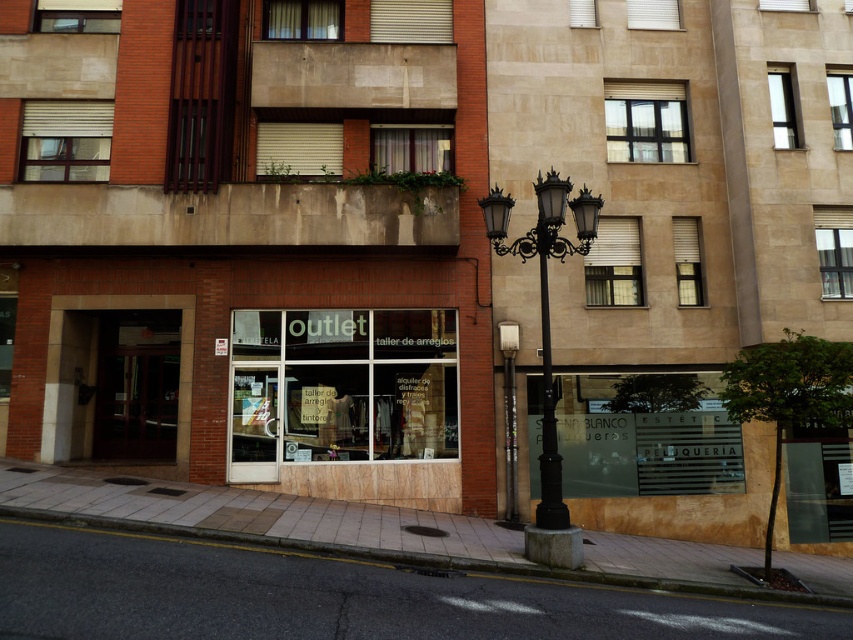
Between transparent glass outlet at center and black wrought iron streetlight at center, which one appears on the left side from the viewer's perspective?

transparent glass outlet at center is more to the left.

Is transparent glass outlet at center smaller than black wrought iron streetlight at center?

Incorrect, transparent glass outlet at center is not smaller in size than black wrought iron streetlight at center.

Who is more forward, (442, 436) or (538, 218)?

Positioned in front is point (538, 218).

Identify the location of transparent glass outlet at center. (344, 400).

Identify the location of transparent glass outlet at center. The height and width of the screenshot is (640, 853). (344, 400).

Can you confirm if transparent glass outlet at center is positioned to the left of black wrought iron pole at center?

Yes, transparent glass outlet at center is to the left of black wrought iron pole at center.

Where is `transparent glass outlet at center`? This screenshot has width=853, height=640. transparent glass outlet at center is located at coordinates (344, 400).

I want to click on transparent glass outlet at center, so click(344, 400).

Which is above, black metal streetlight at center or black wrought iron streetlight at center?

black wrought iron streetlight at center is above.

The width and height of the screenshot is (853, 640). What do you see at coordinates (547, 346) in the screenshot?
I see `black metal streetlight at center` at bounding box center [547, 346].

Locate an element on the screen. The image size is (853, 640). black metal streetlight at center is located at coordinates (547, 346).

Find the location of `black metal streetlight at center`. black metal streetlight at center is located at coordinates (547, 346).